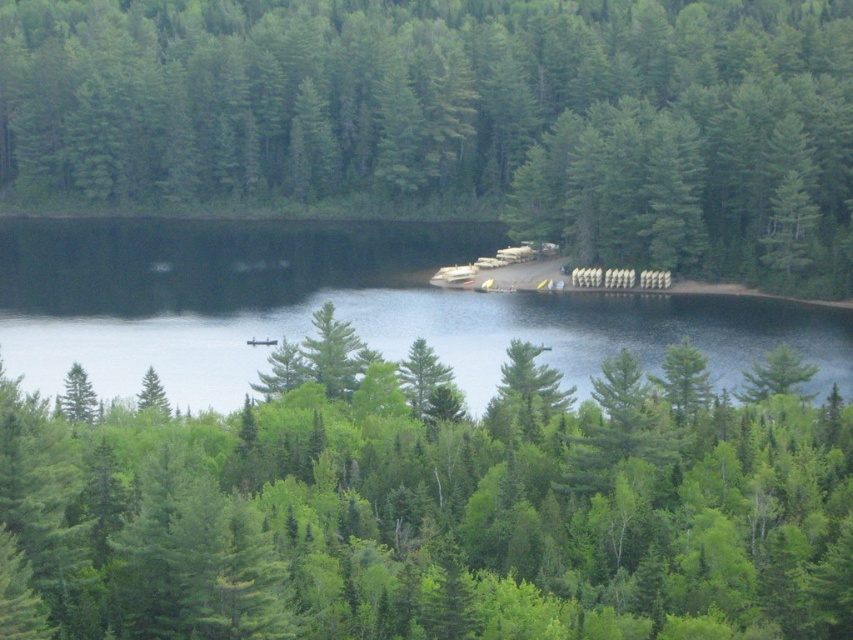
Does green matte tree at center have a greater height compared to green matte trees at center?

Incorrect, green matte tree at center's height is not larger of green matte trees at center's.

The width and height of the screenshot is (853, 640). What do you see at coordinates (434, 508) in the screenshot?
I see `green matte tree at center` at bounding box center [434, 508].

Is point (590, 515) more distant than point (766, 26)?

No, (590, 515) is in front of (766, 26).

Image resolution: width=853 pixels, height=640 pixels. What are the coordinates of `green matte tree at center` in the screenshot? It's located at (434, 508).

Is green matte trees at center behind clear water at center?

Yes, it is.

Which is behind, point (639, 232) or point (239, 346)?

Point (639, 232)

Locate an element on the screen. green matte trees at center is located at coordinates (454, 120).

Which is above, green matte tree at center or clear water at center?

clear water at center is higher up.

Which is in front, point (50, 506) or point (508, 333)?

Point (50, 506) is in front.

Describe the element at coordinates (434, 508) in the screenshot. The width and height of the screenshot is (853, 640). I see `green matte tree at center` at that location.

You are a GUI agent. You are given a task and a screenshot of the screen. Output one action in this format:
    pyautogui.click(x=<x>, y=<y>)
    Task: Click on the green matte tree at center
    The height and width of the screenshot is (640, 853).
    Given the screenshot: What is the action you would take?
    pyautogui.click(x=434, y=508)